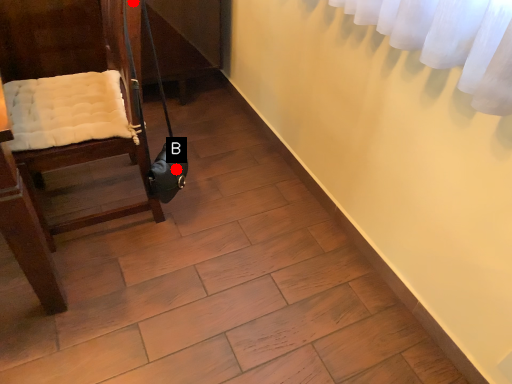
Question: Two points are circled on the image, labeled by A and B beside each circle. Which point appears farthest from the camera in this image?

Choices:
 (A) A is further
 (B) B is further

Answer: (B)